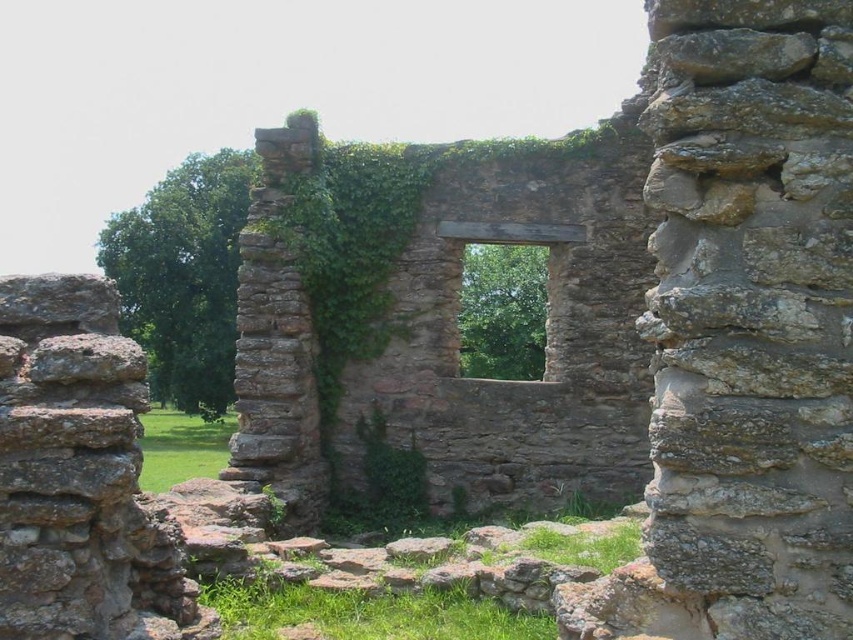
Question: Among these points, which one is nearest to the camera?

Choices:
 (A) (165, 378)
 (B) (506, 300)

Answer: (B)

Question: Is the position of green leafy ivy at center more distant than that of brown stone window at center?

Choices:
 (A) yes
 (B) no

Answer: (A)

Question: Can you confirm if green leafy ivy at center is smaller than brown stone window at center?

Choices:
 (A) no
 (B) yes

Answer: (A)

Question: Which point is farther to the camera?

Choices:
 (A) (165, 352)
 (B) (495, 250)

Answer: (A)

Question: Is green leafy ivy at center above brown stone window at center?

Choices:
 (A) no
 (B) yes

Answer: (B)